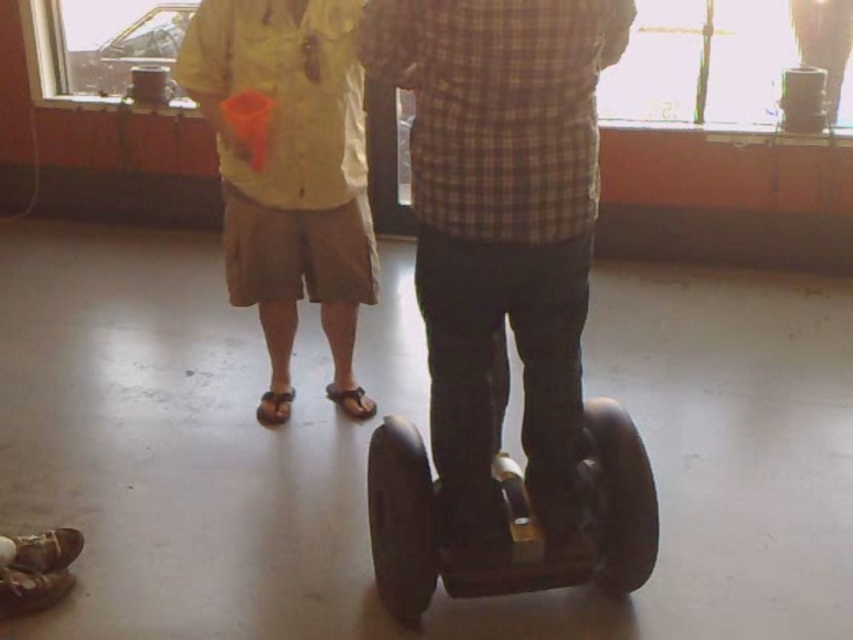
You are a photographer positioned in front of the window. You want to take a photo of both the plaid shirt at center and the matte yellow shirt at center. Which shirt should you focus on first to ensure both are in focus?

You should focus on the plaid shirt at center first because it is closer to the viewer, so adjusting focus from near to far will help both shirts be in focus.

You are a delivery robot that needs to move from your current position to the window to deliver a package. The path is blocked by two objects, the matte yellow shirt at center and the black rubber segway at center. The robot is 36 inches wide. Can you navigate through the space between the two objects?

The matte yellow shirt at center is 37.01 inches away from the black rubber segway at center. Since the robot is 36 inches wide, it can fit through the space between them as the distance is slightly larger than the robot.